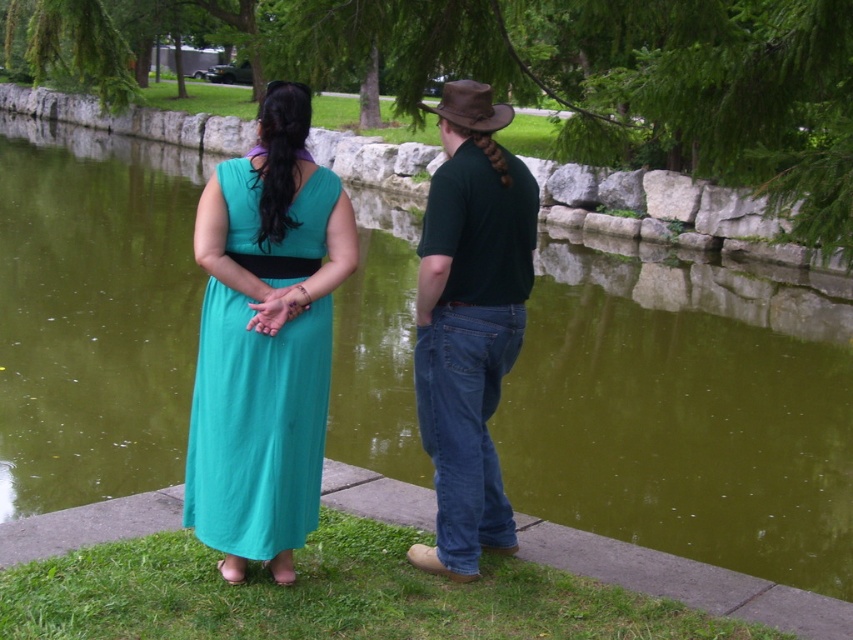
Does dark green cotton shirt at center have a lesser width compared to teal fabric dress at center?

Yes, dark green cotton shirt at center is thinner than teal fabric dress at center.

Where is `dark green cotton shirt at center`? dark green cotton shirt at center is located at coordinates (469, 323).

Can you confirm if matte green dress at center is positioned below dark green cotton shirt at center?

Yes.

Is matte green dress at center thinner than dark green cotton shirt at center?

No.

Is point (265, 113) closer to camera compared to point (477, 145)?

Yes, it is in front of point (477, 145).

Find the location of a particular element. This screenshot has height=640, width=853. matte green dress at center is located at coordinates (265, 340).

Which is more to the left, matte green dress at center or teal fabric dress at center?

Positioned to the left is teal fabric dress at center.

This screenshot has width=853, height=640. What do you see at coordinates (265, 340) in the screenshot?
I see `matte green dress at center` at bounding box center [265, 340].

Identify the location of matte green dress at center. (265, 340).